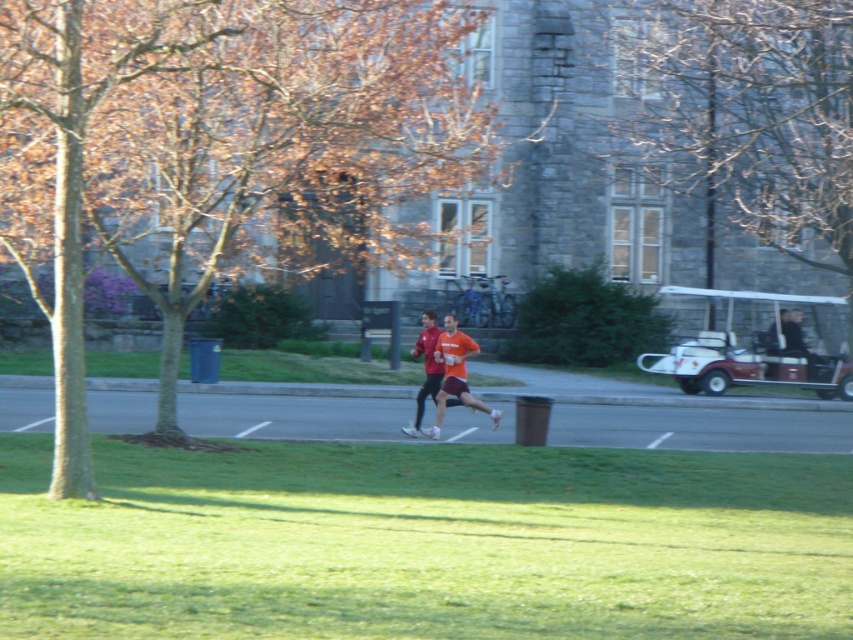
You are a jogger who wants to pass by the matte red shirt at center without getting too close to the maroon plastic golf cart at right. Which direction should you move in?

The maroon plastic golf cart at right is positioned on the right side of matte red shirt at center. To avoid it, move to the left side of the matte red shirt at center.

You are standing at the point labeled as point (474, 353) and want to walk towards the point labeled as point (93, 6). Which direction should you face to move towards it?

You should face towards the direction of point (93, 6) since it is closer to the viewer compared to your current position at point (474, 353).

You are a photographer trying to capture a photo of the matte red shirt at center and the bare branches at upper center. Which object is taller in the scene?

The bare branches at upper center is taller than the matte red shirt at center.